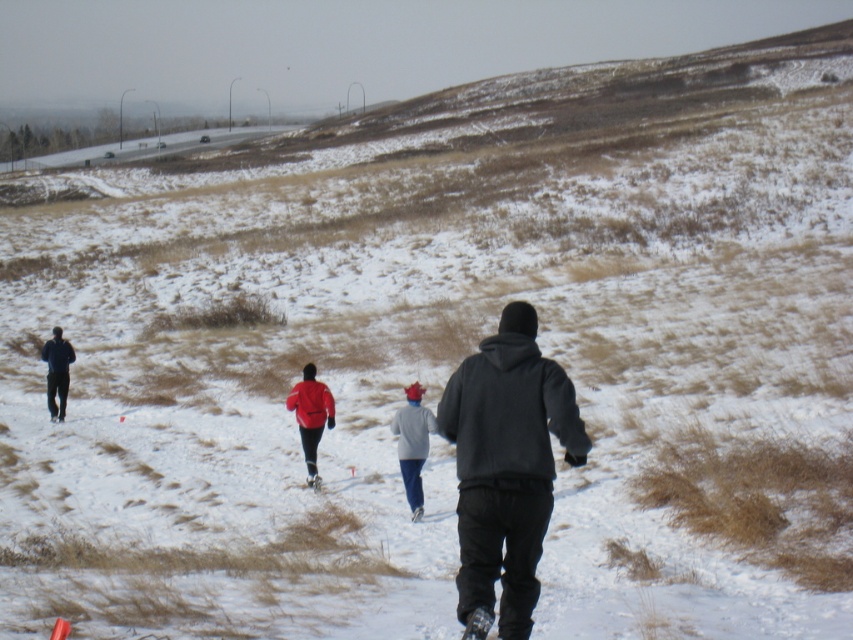
You are trying to decide whether to carry the dark gray hoodie at center or the white matte ski at center while walking on the snow. Based on their sizes, which item would be easier to carry without it getting in your way?

The dark gray hoodie at center might be wider than the white matte ski at center, so the ski might be easier to carry as it is narrower.

You are standing at the point labeled point (524, 396) and want to move towards the point labeled point (300, 429). Which direction should you move to get closer to your destination?

You should move away from the camera because point (524, 396) is closer to the camera than point (300, 429).

Consider the image. You are a photographer trying to capture a photo of the dark blue jacket at left and the white matte ski at center. Which object should you focus on first if you want to ensure both are in the frame without moving the camera?

The dark blue jacket at left should be focused on first since it is positioned on the left side of the white matte ski at center, so adjusting focus to the left ensures both are included in the frame.